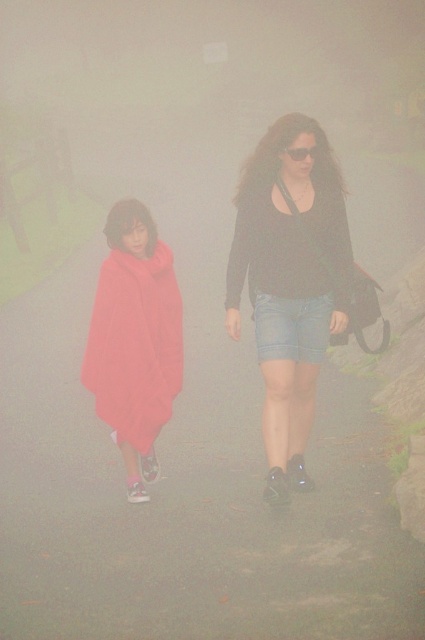
You are a photographer trying to capture a clear shot of the denim shorts at center and the matte red blanket at left. Since the scene is foggy, you want to know which object is bigger to focus on. Which object should you focus on?

The denim shorts at center has a larger size compared to the matte red blanket at left, so you should focus on the denim shorts at center because it is bigger and more likely to be clearer in the photo.

You are a photographer trying to capture the denim shorts at center and the matte red blanket at left in a single frame. Based on their sizes, which object would appear larger in the photo?

The denim shorts at center might appear larger in the photo since they are wider than the matte red blanket at left.